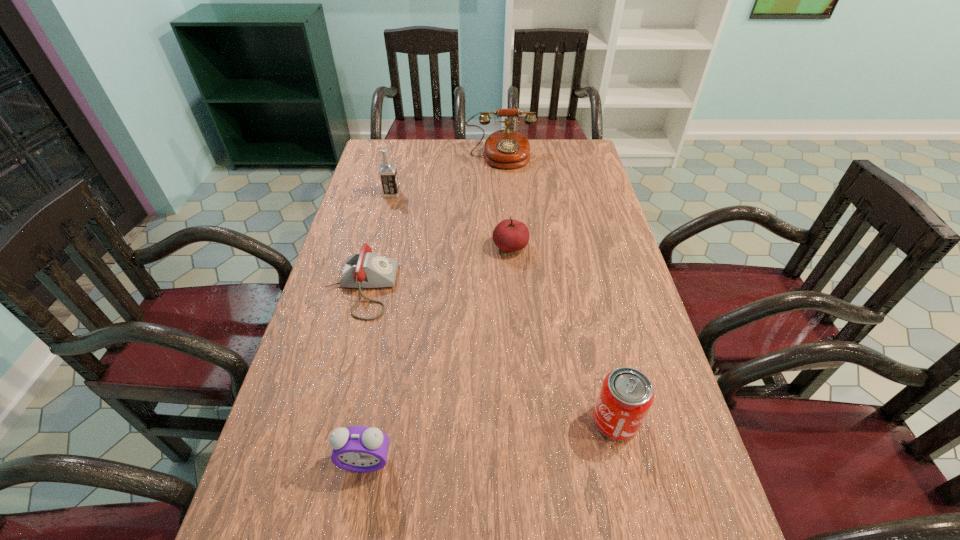
The image size is (960, 540). I want to click on free space located 0.150m on the front label of the vodka, so click(442, 194).

The width and height of the screenshot is (960, 540). Identify the location of vacant space situated 0.050m on the right of the rightmost object. (661, 421).

Locate an element on the screen. This screenshot has height=540, width=960. vacant region located 0.080m on the face of the nearest object is located at coordinates (355, 517).

Where is `free region located on the right of the third farthest object`? This screenshot has height=540, width=960. free region located on the right of the third farthest object is located at coordinates (581, 247).

The width and height of the screenshot is (960, 540). Identify the location of vacant space located on the dial of the nearer telephone. (502, 288).

Find the location of a particular element. This screenshot has width=960, height=540. object that is at the far edge is located at coordinates (507, 149).

Locate an element on the screen. Image resolution: width=960 pixels, height=540 pixels. vodka located at the left edge is located at coordinates (x=387, y=171).

Locate an element on the screen. The width and height of the screenshot is (960, 540). alarm clock situated at the left edge is located at coordinates (363, 449).

This screenshot has height=540, width=960. Identify the location of telephone situated at the left edge. click(364, 269).

Locate an element on the screen. The width and height of the screenshot is (960, 540). object at the right edge is located at coordinates (626, 395).